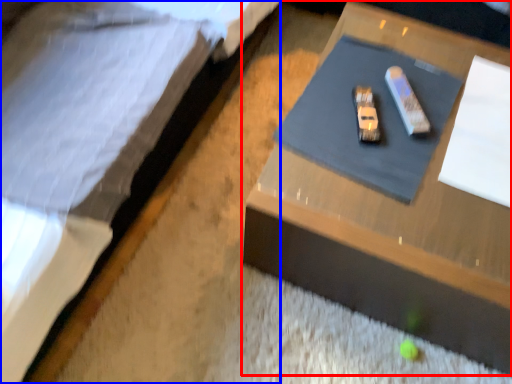
Question: Which object appears closest to the camera in this image, table (highlighted by a red box) or bed (highlighted by a blue box)?

Choices:
 (A) table
 (B) bed

Answer: (B)